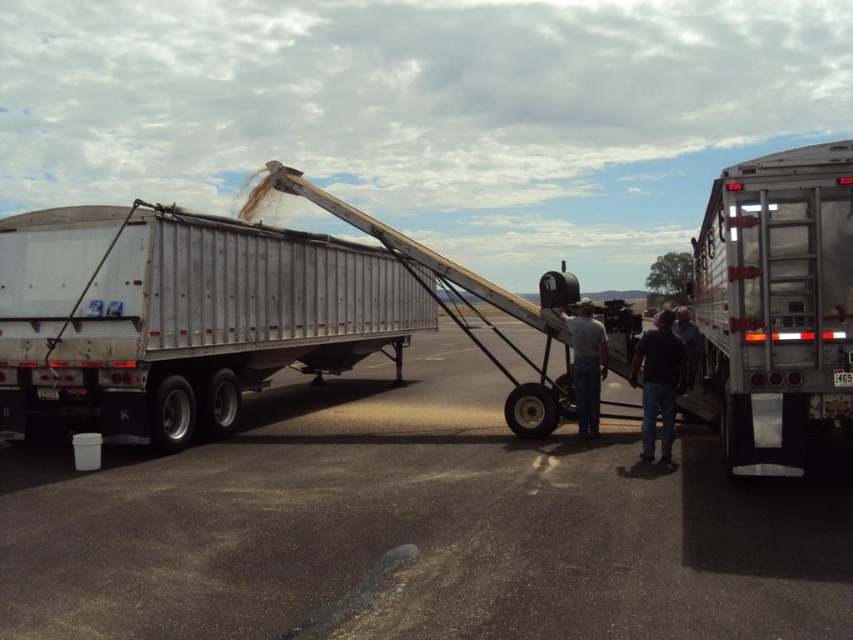
Does silver metallic trailer at left come in front of dark blue jeans at center?

That is False.

Between silver metallic trailer at left and dark blue jeans at center, which one is positioned higher?

Positioned higher is silver metallic trailer at left.

Is point (397, 380) closer to camera compared to point (683, 380)?

No, it is behind (683, 380).

Identify the location of silver metallic trailer at left. (180, 317).

Between silver metallic trailer at left and silver metallic trailer at right, which one has more height?

silver metallic trailer at right

Is silver metallic trailer at left above silver metallic trailer at right?

Incorrect, silver metallic trailer at left is not positioned above silver metallic trailer at right.

Who is more distant from viewer, [242,244] or [792,291]?

The point [242,244] is behind.

Identify the location of silver metallic trailer at left. (180, 317).

Which is above, dark blue jeans at center or denim jeans at center?

denim jeans at center is above.

Does dark blue jeans at center have a greater height compared to denim jeans at center?

No.

Who is more distant from viewer, (639, 454) or (598, 376)?

Point (598, 376)

Locate an element on the screen. dark blue jeans at center is located at coordinates (659, 381).